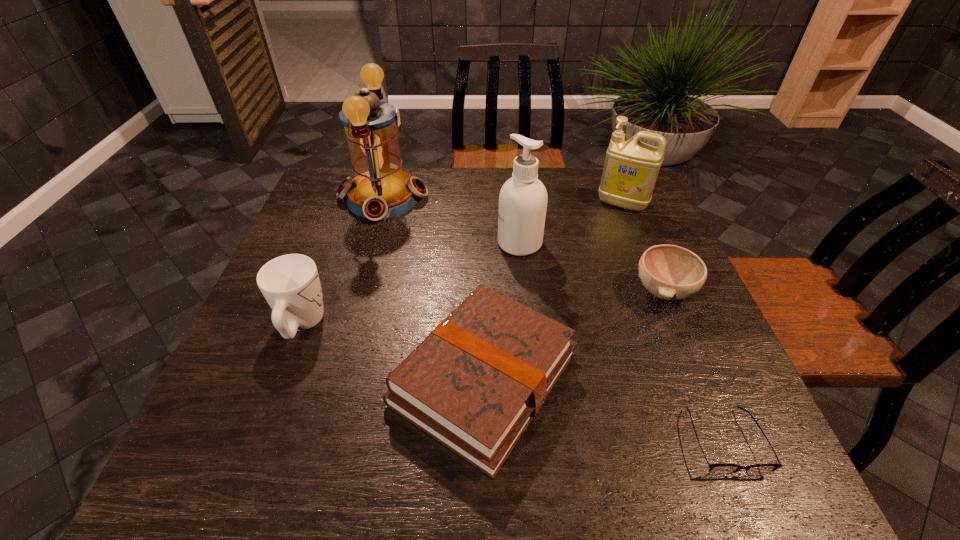
Locate an element on the screen. The width and height of the screenshot is (960, 540). lantern is located at coordinates (380, 189).

The width and height of the screenshot is (960, 540). I want to click on cleansing agent, so click(523, 198).

Find the location of a particular element. the sixth shortest object is located at coordinates (523, 198).

Locate an element on the screen. This screenshot has height=540, width=960. the fifth shortest object is located at coordinates (631, 168).

The image size is (960, 540). Find the location of `the fourth tallest object`. the fourth tallest object is located at coordinates click(x=290, y=283).

You are a GUI agent. You are given a task and a screenshot of the screen. Output one action in this format:
    pyautogui.click(x=<x>, y=<y>)
    Task: Click on the bowl
    
    Given the screenshot: What is the action you would take?
    pyautogui.click(x=670, y=272)

The height and width of the screenshot is (540, 960). What are the coordinates of `hardback book` in the screenshot? It's located at (474, 384).

Where is `spectacles`? spectacles is located at coordinates (715, 469).

This screenshot has height=540, width=960. Find the location of `free region located 0.230m on the front-facing side of the lantern`. free region located 0.230m on the front-facing side of the lantern is located at coordinates (504, 198).

Identify the location of free space located on the front label of the cleansing agent. (416, 244).